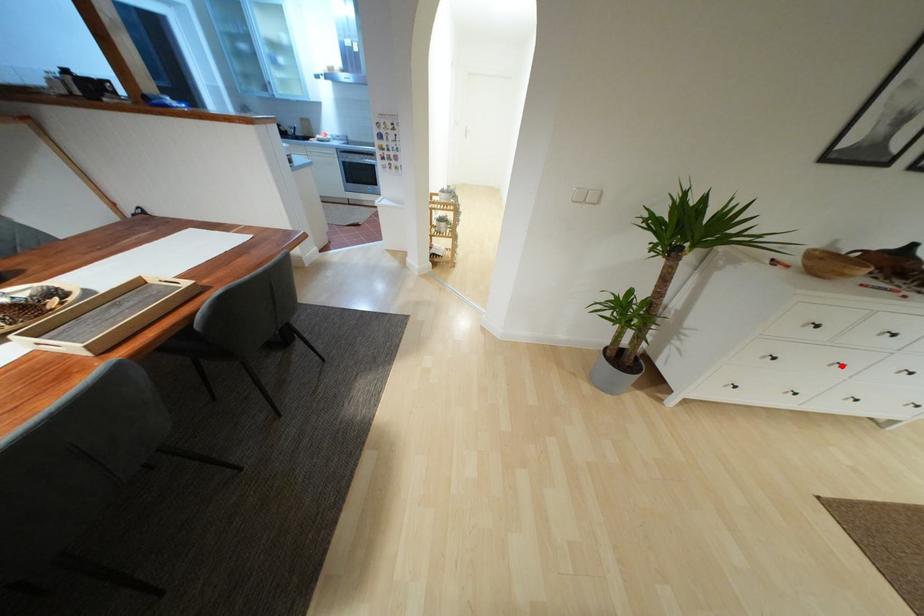
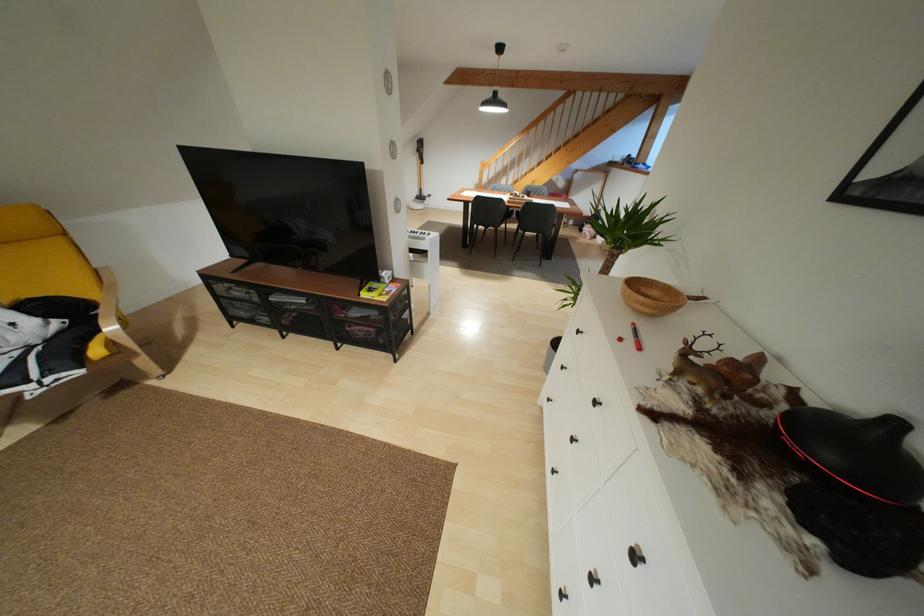
Find the pixel in the second image that matches the highlighted location in the first image.

(572, 439)